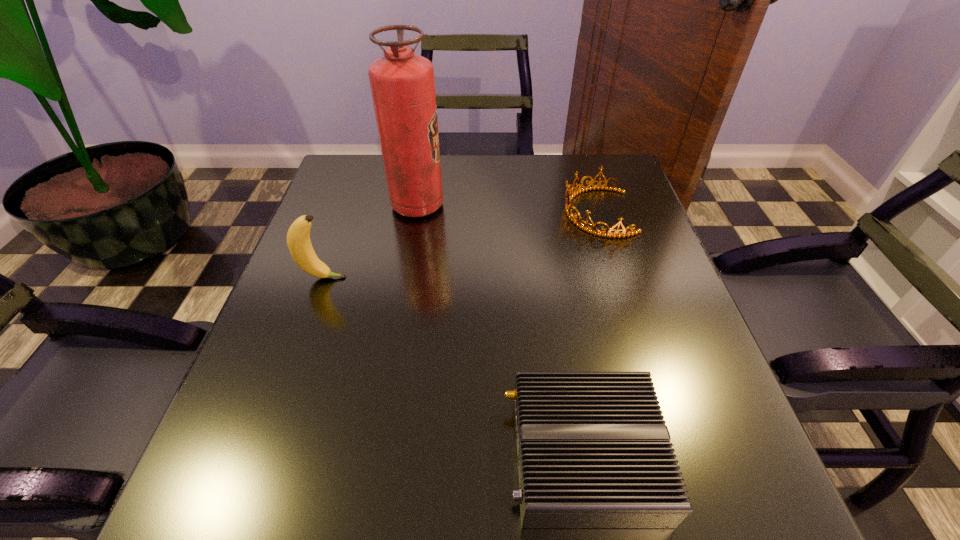
At what (x,y) coordinates should I click in order to perform the action: click on free point between the nearest object and the leftmost object. Please return your answer as a coordinate pair (x, y). This screenshot has width=960, height=540. Looking at the image, I should click on (454, 367).

Where is `free space between the third farthest object and the third tallest object`? The width and height of the screenshot is (960, 540). free space between the third farthest object and the third tallest object is located at coordinates (460, 245).

The height and width of the screenshot is (540, 960). I want to click on vacant point located between the tiara and the shortest object, so click(x=590, y=334).

Locate an element on the screen. Image resolution: width=960 pixels, height=540 pixels. unoccupied position between the third tallest object and the nearest object is located at coordinates (590, 334).

At what (x,y) coordinates should I click in order to perform the action: click on vacant area between the shortest object and the tallest object. Please return your answer as a coordinate pair (x, y). The width and height of the screenshot is (960, 540). Looking at the image, I should click on (500, 330).

Locate an element on the screen. This screenshot has width=960, height=540. unoccupied area between the tiara and the tallest object is located at coordinates (507, 209).

I want to click on free spot between the shortest object and the second nearest object, so click(454, 367).

Locate an element on the screen. This screenshot has height=540, width=960. free space between the third tallest object and the nearest object is located at coordinates (590, 334).

Locate an element on the screen. The image size is (960, 540). free point between the second shortest object and the banana is located at coordinates (460, 245).

In order to click on unoccupied position between the router and the third tallest object in this screenshot , I will do `click(590, 334)`.